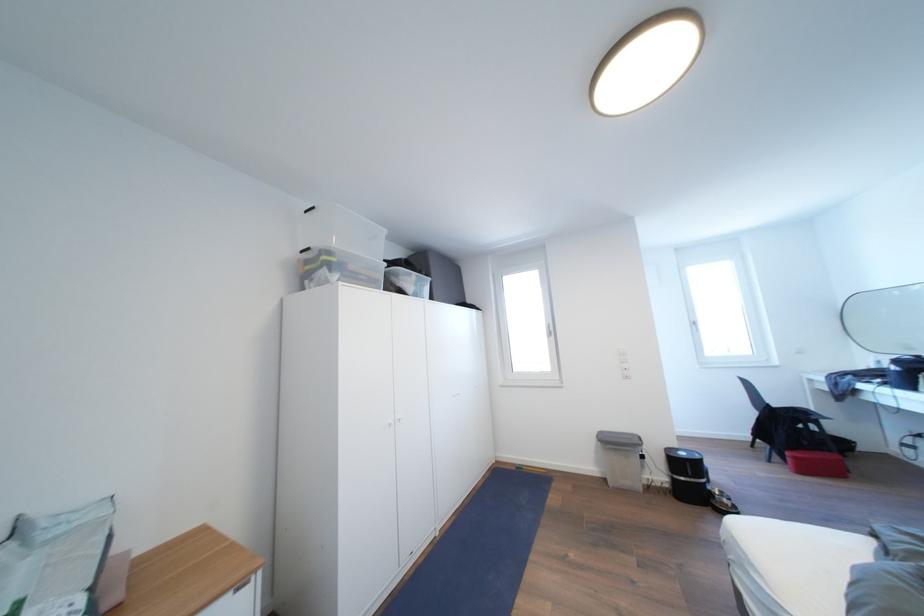
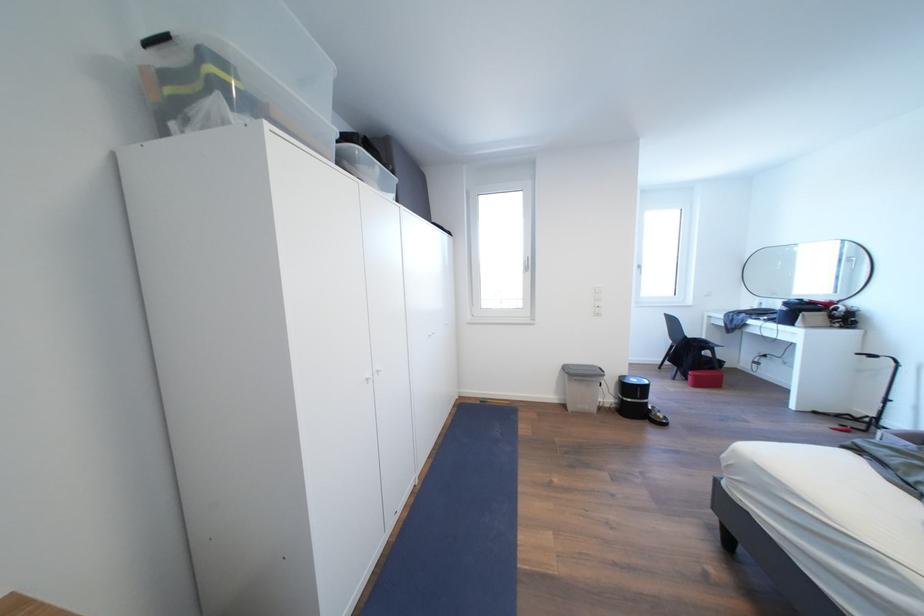
Locate, in the second image, the point that corresponds to pixel 803 463 in the first image.

(703, 381)